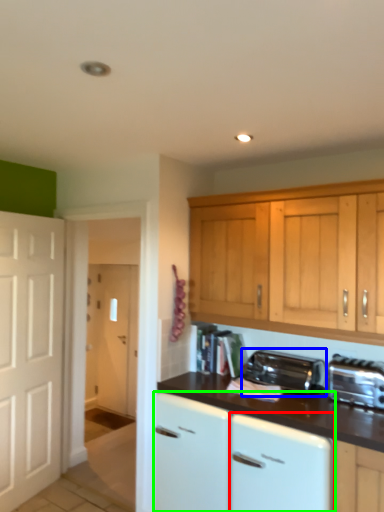
Question: Which object is the closest to the dish washer (highlighted by a red box)? Choose among these: kitchen appliance (highlighted by a blue box) or cabinetry (highlighted by a green box).

Choices:
 (A) kitchen appliance
 (B) cabinetry

Answer: (B)